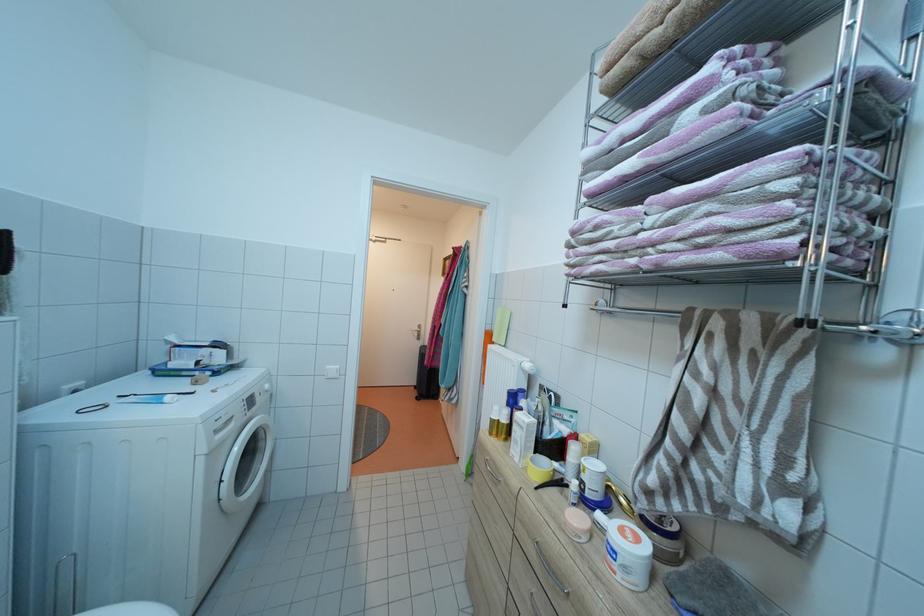
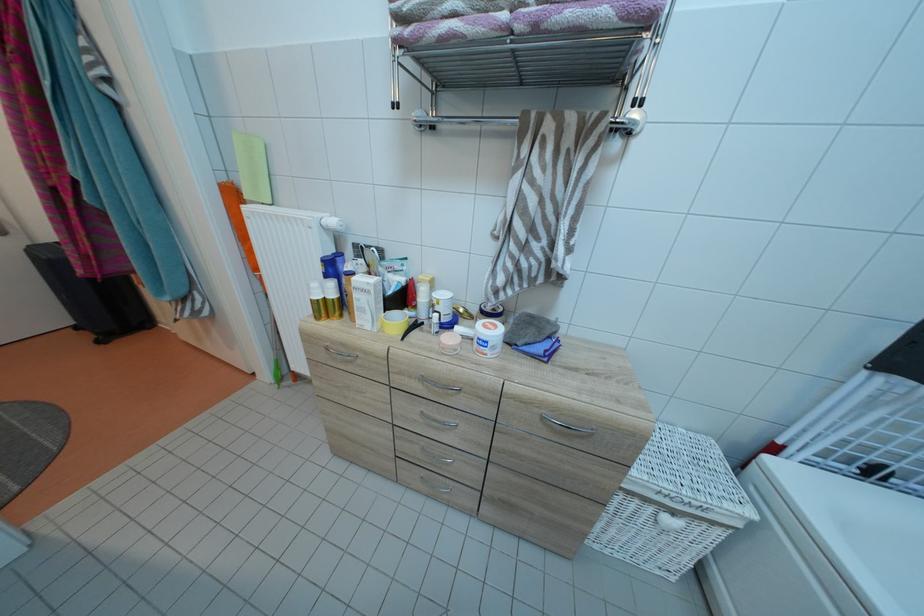
In the second image, find the point that corresponds to [633,543] in the first image.

(496, 334)